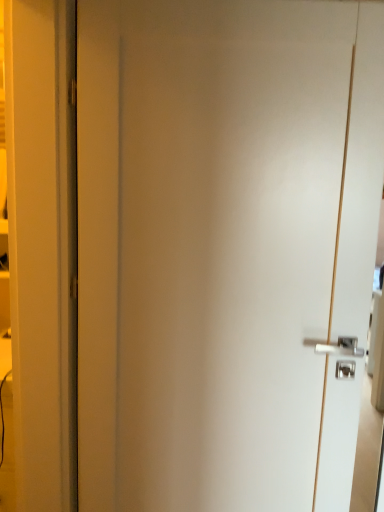
This screenshot has width=384, height=512. What do you see at coordinates (43, 247) in the screenshot? I see `white glossy door at center` at bounding box center [43, 247].

Image resolution: width=384 pixels, height=512 pixels. What are the coordinates of `white glossy door at center` in the screenshot? It's located at pos(43,247).

Find the location of `white glossy door at center`. white glossy door at center is located at coordinates (43, 247).